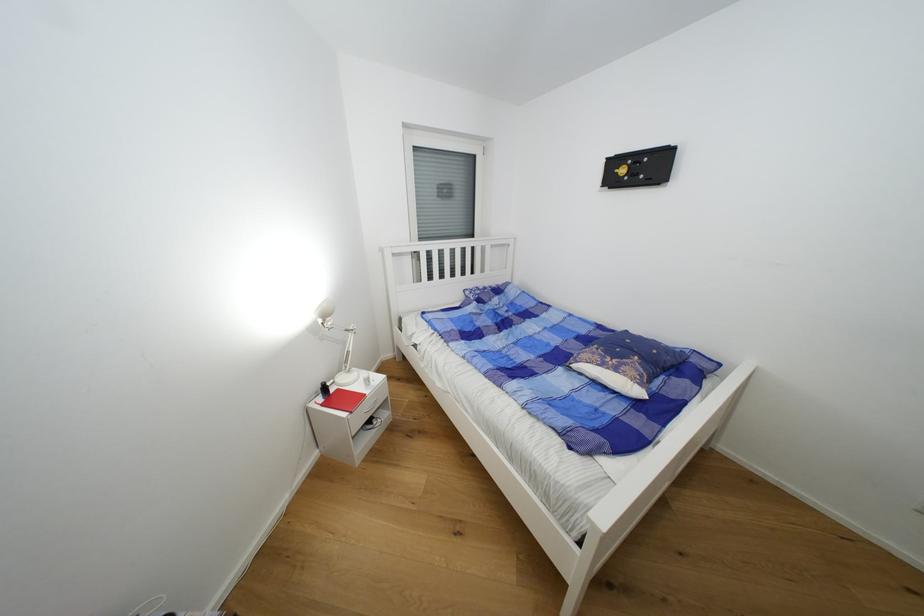
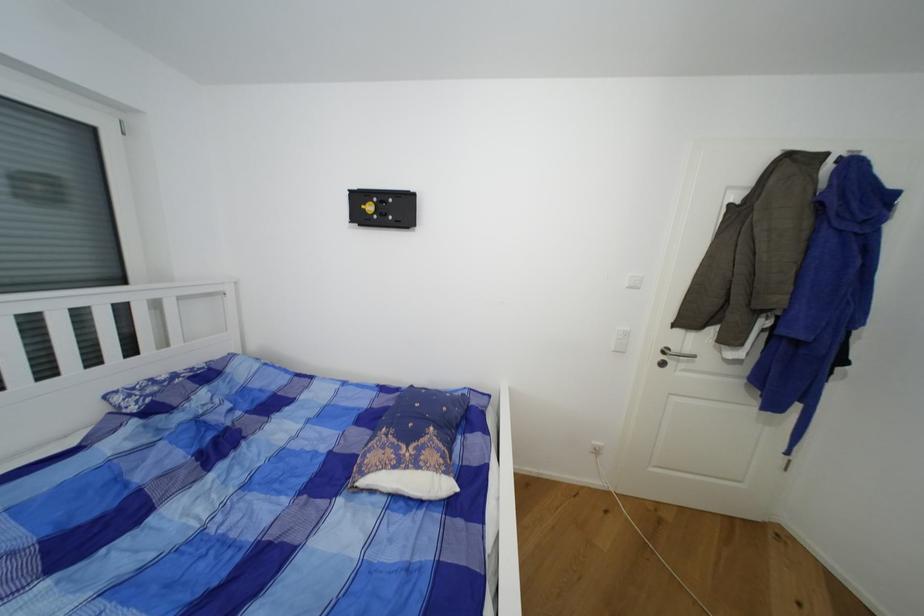
Locate, in the second image, the point that corresponds to the point at 643,394 in the first image.

(454, 488)